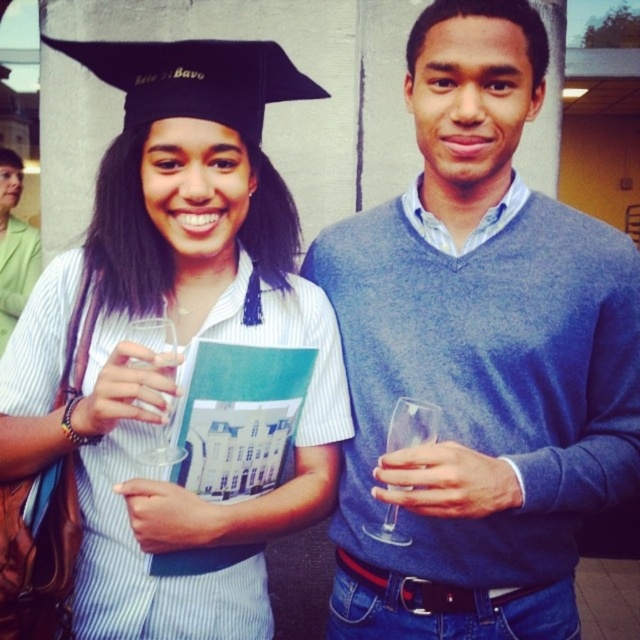
You are standing in front of the two people in the image. Which of the two points, point (605, 317) or point (376, 529), is closer to you?

Point (605, 317) is closer to you because it is further to the viewer than point (376, 529).

What is the color of the clothing item located at the coordinates point (477, 356)?

The point (477, 356) corresponds to the blue sweater at center.